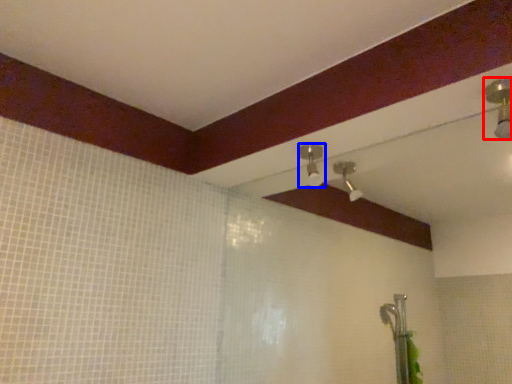
Question: Which point is closer to the camera, shower (highlighted by a red box) or shower (highlighted by a blue box)?

Choices:
 (A) shower
 (B) shower

Answer: (A)